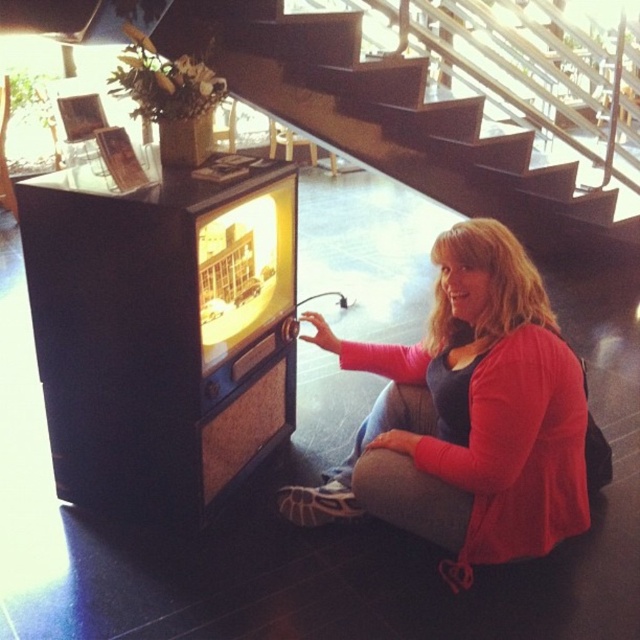
You are a guest in this room and want to sit on the pink fabric at lower center. However, you also notice the dark wood stairs at center. Considering their sizes, which one do you think is more suitable for sitting comfortably?

The dark wood stairs at center are larger in size compared to the pink fabric at lower center, so sitting comfortably would be more feasible on the dark wood stairs at center.

You are a delivery person needing to place a 5.5 feet long package between the pink fabric at lower center and the dark wood stairs at center. Can you fit the package in the space between them without moving either object?

The pink fabric at lower center and dark wood stairs at center are 6.00 feet apart, so yes, the 5.5 feet long package can fit between them as it is shorter than the available space.

You are standing in the room and want to place a small decorative item on the nearest surface. Which surface should you choose between the pink fabric at lower center and the dark wood stairs at center?

The pink fabric at lower center is closer to the viewer than the dark wood stairs at center, so you should choose the pink fabric at lower center as the nearest surface to place the decorative item.